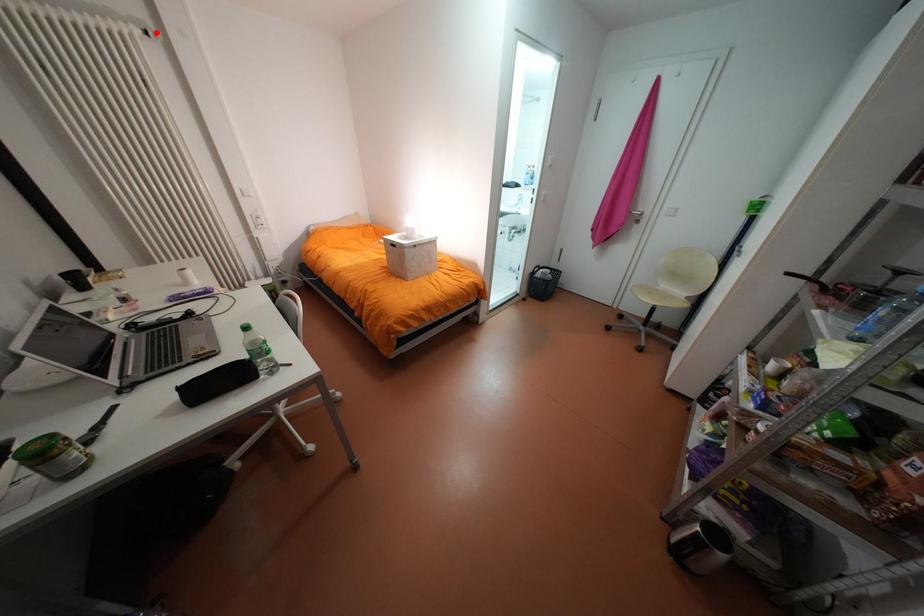
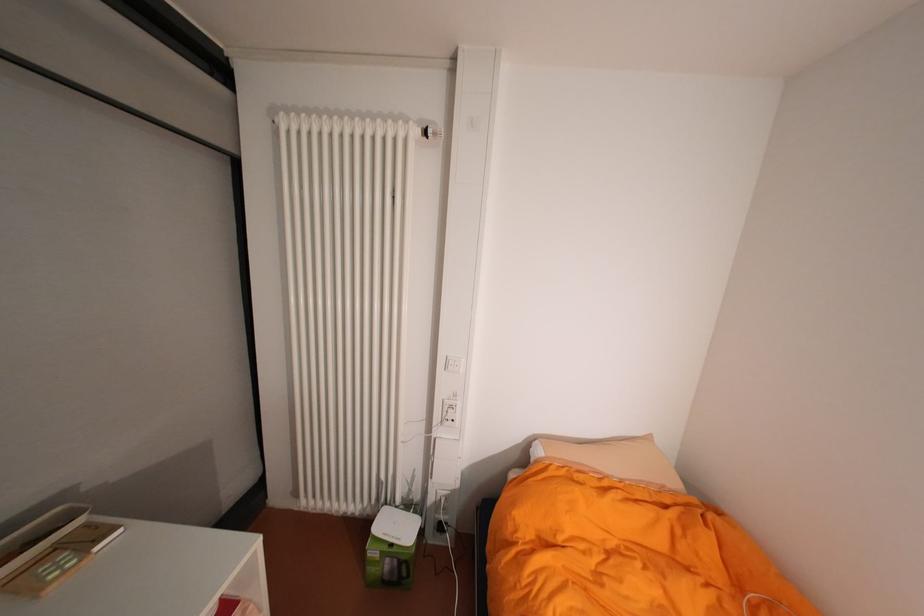
In the second image, find the point that corresponds to the highlighted location in the first image.

(434, 132)